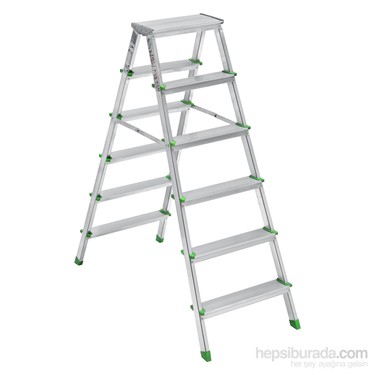
The height and width of the screenshot is (375, 375). In order to click on front side of ladder where you climb up in this screenshot , I will do `click(176, 184)`, `click(252, 157)`, `click(185, 229)`, `click(196, 290)`, `click(279, 257)`, `click(263, 205)`, `click(237, 100)`, `click(224, 52)`, `click(155, 60)`, `click(165, 112)`.